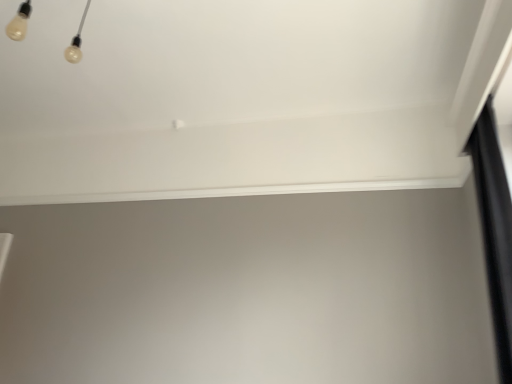
Question: From the image's perspective, is black matte curtain at right above or below white smooth window sill at upper center?

Choices:
 (A) above
 (B) below

Answer: (B)

Question: Would you say black matte curtain at right is to the left or to the right of white smooth window sill at upper center in the picture?

Choices:
 (A) right
 (B) left

Answer: (A)

Question: From a real-world perspective, is black matte curtain at right positioned above or below white smooth window sill at upper center?

Choices:
 (A) above
 (B) below

Answer: (B)

Question: From their relative heights in the image, would you say white smooth window sill at upper center is taller or shorter than black matte curtain at right?

Choices:
 (A) short
 (B) tall

Answer: (A)

Question: Looking at the image, does white smooth window sill at upper center seem bigger or smaller compared to black matte curtain at right?

Choices:
 (A) small
 (B) big

Answer: (A)

Question: Does point (257, 187) appear closer or farther from the camera than point (492, 173)?

Choices:
 (A) closer
 (B) farther

Answer: (B)

Question: Is white smooth window sill at upper center in front of or behind black matte curtain at right in the image?

Choices:
 (A) behind
 (B) front

Answer: (A)